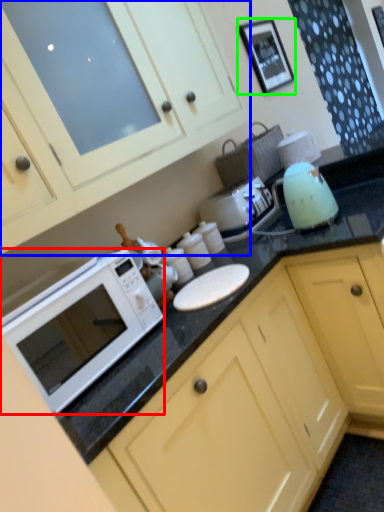
Question: Estimate the real-world distances between objects in this image. Which object is closer to microwave oven (highlighted by a red box), cabinetry (highlighted by a blue box) or picture frame (highlighted by a green box)?

Choices:
 (A) cabinetry
 (B) picture frame

Answer: (A)